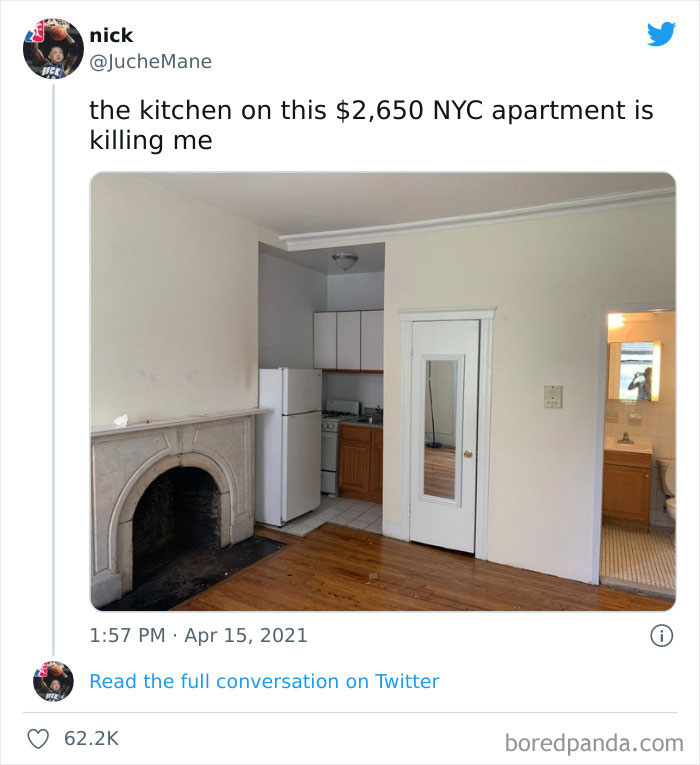
What are the coordinates of `light` in the screenshot? It's located at (344, 262).